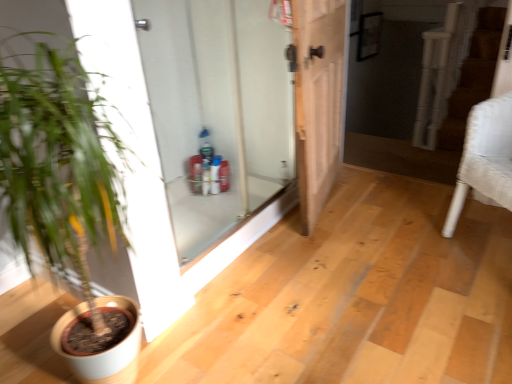
Question: Based on their sizes in the image, would you say white textured armchair at right is bigger or smaller than white matte pot at left?

Choices:
 (A) small
 (B) big

Answer: (A)

Question: Does point pyautogui.click(x=502, y=168) appear closer or farther from the camera than point pyautogui.click(x=86, y=296)?

Choices:
 (A) farther
 (B) closer

Answer: (A)

Question: Considering the real-world distances, which object is farthest from the white matte pot at left?

Choices:
 (A) light brown wooden door at center, arranged as the 2th door when viewed from the left
 (B) white textured armchair at right
 (C) white glass door at center, acting as the first door starting from the left

Answer: (B)

Question: Estimate the real-world distances between objects in this image. Which object is closer to the white textured armchair at right?

Choices:
 (A) white matte pot at left
 (B) light brown wooden door at center, which appears as the 1th door when viewed from the right
 (C) white glass door at center, acting as the first door starting from the left

Answer: (B)